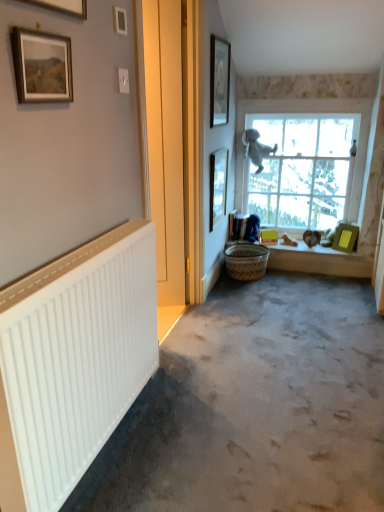
Where is `empty space that is ontop of white plastic radiator at left (from a real-world perspective)`? The width and height of the screenshot is (384, 512). empty space that is ontop of white plastic radiator at left (from a real-world perspective) is located at coordinates (57, 264).